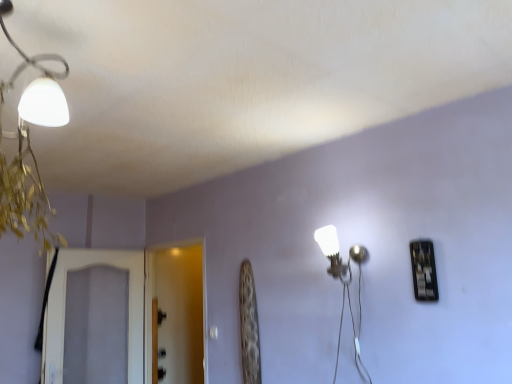
Question: From a real-world perspective, does white textured screen door at left, acting as the 2th screen door starting from the right, stand above transparent glass screen door at center, the 2th screen door from the left?

Choices:
 (A) no
 (B) yes

Answer: (A)

Question: From the image's perspective, is white textured screen door at left, the 1th screen door viewed from the left, over transparent glass screen door at center, the first screen door in the right-to-left sequence?

Choices:
 (A) yes
 (B) no

Answer: (B)

Question: Does white textured screen door at left, acting as the 2th screen door starting from the right, have a lesser width compared to transparent glass screen door at center, the 2th screen door from the left?

Choices:
 (A) yes
 (B) no

Answer: (A)

Question: Is white textured screen door at left, the 1th screen door viewed from the left, in front of transparent glass screen door at center, the first screen door in the right-to-left sequence?

Choices:
 (A) yes
 (B) no

Answer: (A)

Question: Is white textured screen door at left, the 1th screen door viewed from the left, taller than transparent glass screen door at center, the first screen door in the right-to-left sequence?

Choices:
 (A) yes
 (B) no

Answer: (B)

Question: Is transparent glass screen door at center, the first screen door in the right-to-left sequence, inside or outside of white textured screen door at left, acting as the 2th screen door starting from the right?

Choices:
 (A) outside
 (B) inside

Answer: (A)

Question: In terms of height, does transparent glass screen door at center, the first screen door in the right-to-left sequence, look taller or shorter compared to white textured screen door at left, the 1th screen door viewed from the left?

Choices:
 (A) tall
 (B) short

Answer: (A)

Question: From a real-world perspective, is transparent glass screen door at center, the first screen door in the right-to-left sequence, positioned above or below white textured screen door at left, the 1th screen door viewed from the left?

Choices:
 (A) below
 (B) above

Answer: (B)

Question: Based on their sizes in the image, would you say transparent glass screen door at center, the 2th screen door from the left, is bigger or smaller than white textured screen door at left, acting as the 2th screen door starting from the right?

Choices:
 (A) big
 (B) small

Answer: (A)

Question: Is point (185, 289) closer or farther from the camera than point (351, 276)?

Choices:
 (A) farther
 (B) closer

Answer: (A)

Question: From the image's perspective, is transparent glass screen door at center, the 2th screen door from the left, positioned above or below white glossy wall lamp at center-right?

Choices:
 (A) above
 (B) below

Answer: (B)

Question: Considering the positions of transparent glass screen door at center, the 2th screen door from the left, and white glossy wall lamp at center-right in the image, is transparent glass screen door at center, the 2th screen door from the left, wider or thinner than white glossy wall lamp at center-right?

Choices:
 (A) thin
 (B) wide

Answer: (A)

Question: Based on their positions, is transparent glass screen door at center, the first screen door in the right-to-left sequence, located to the left or right of white glossy wall lamp at center-right?

Choices:
 (A) left
 (B) right

Answer: (A)

Question: From the image's perspective, is white glossy wall lamp at center-right located above or below transparent glass screen door at center, the 2th screen door from the left?

Choices:
 (A) below
 (B) above

Answer: (B)

Question: Considering the positions of white glossy wall lamp at center-right and transparent glass screen door at center, the 2th screen door from the left, in the image, is white glossy wall lamp at center-right bigger or smaller than transparent glass screen door at center, the 2th screen door from the left,?

Choices:
 (A) big
 (B) small

Answer: (B)